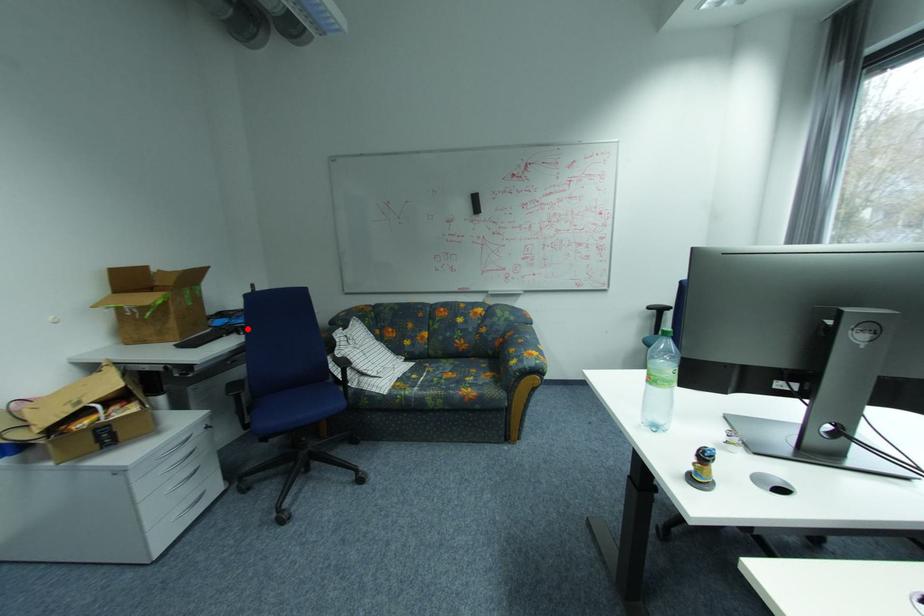
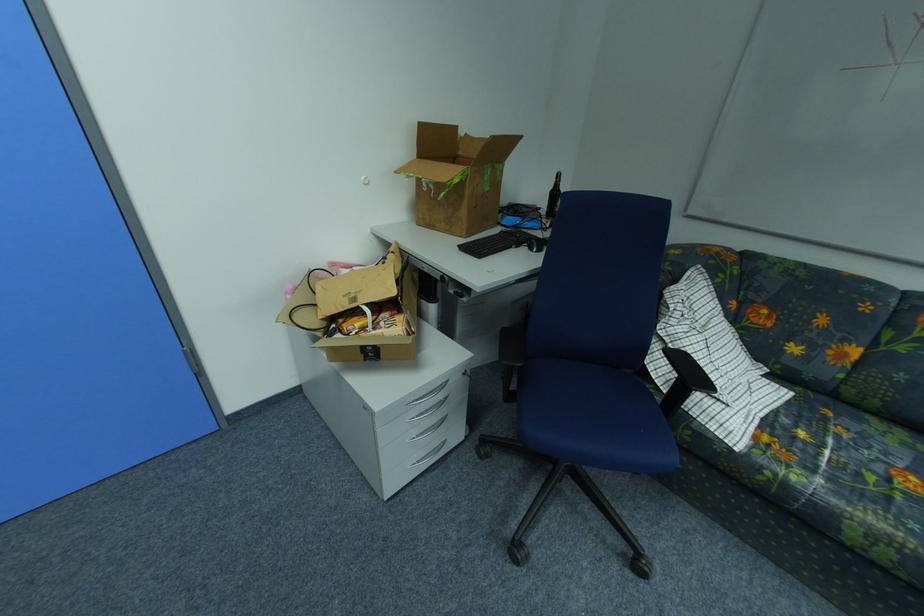
Where in the second image is the point corresponding to the highlighted location from the first image?

(541, 241)